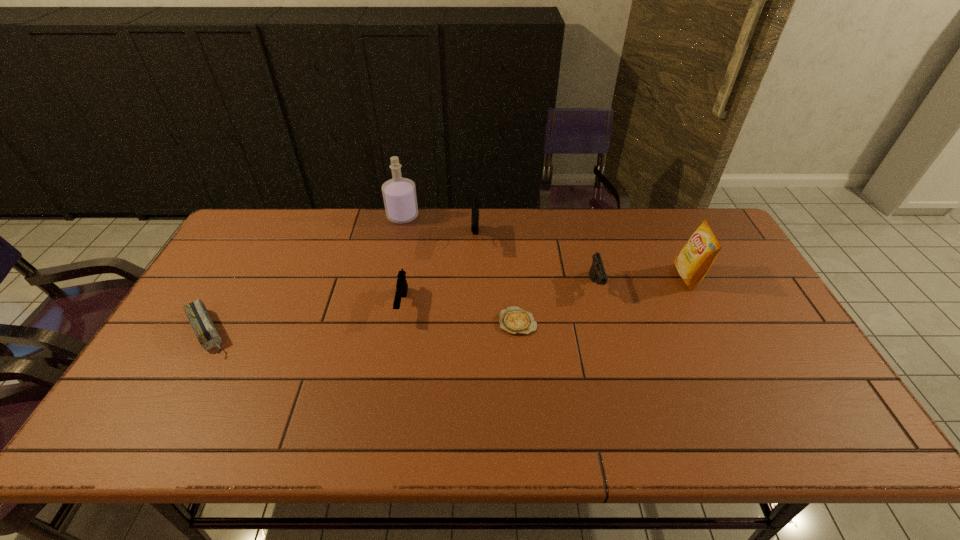
Identify the location of perfume that is positioned at the far edge. The width and height of the screenshot is (960, 540). (399, 194).

Find the location of a particular element. The image size is (960, 540). pistol that is positioned at the far edge is located at coordinates (475, 203).

Locate an element on the screen. The width and height of the screenshot is (960, 540). object located at the left edge is located at coordinates (207, 334).

I want to click on object at the right edge, so click(695, 259).

In the image, there is a desktop. Identify the location of vacant area at the far edge. Image resolution: width=960 pixels, height=540 pixels. (372, 235).

This screenshot has width=960, height=540. What are the coordinates of `vacant space at the near edge of the desktop` in the screenshot? It's located at (705, 414).

The image size is (960, 540). I want to click on free region at the left edge of the desktop, so click(x=169, y=353).

Locate an element on the screen. free spot at the right edge of the desktop is located at coordinates (756, 321).

Image resolution: width=960 pixels, height=540 pixels. I want to click on vacant space at the far left corner of the desktop, so click(252, 212).

Locate an element on the screen. blank region between the perfume and the shortest object is located at coordinates (460, 269).